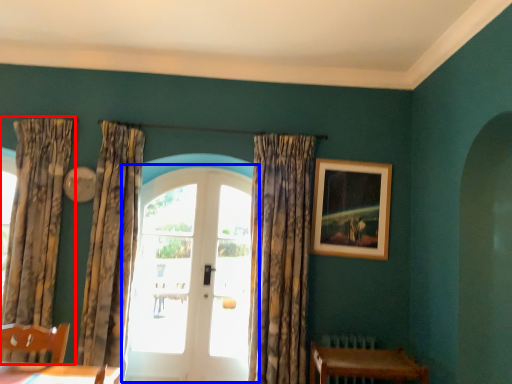
Question: Which object appears closest to the camera in this image, curtain (highlighted by a red box) or door (highlighted by a blue box)?

Choices:
 (A) curtain
 (B) door

Answer: (A)